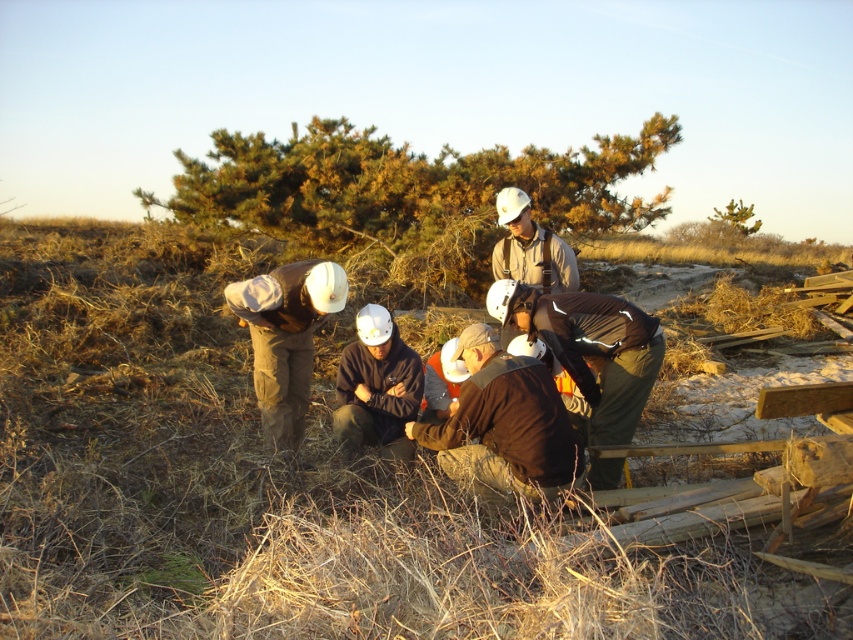
Question: Observing the image, what is the correct spatial positioning of brown fabric jacket at center in reference to dark brown leather jacket at lower center?

Choices:
 (A) below
 (B) above

Answer: (A)

Question: In this image, where is brown fabric jacket at center located relative to dark brown leather jacket at lower center?

Choices:
 (A) above
 (B) below

Answer: (B)

Question: Considering the real-world distances, which object is closest to the matte white hard hat at center?

Choices:
 (A) dark brown jacket at center
 (B) brown fabric jacket at center
 (C) dark brown leather jacket at lower center

Answer: (A)

Question: Which point is farther from the camera taking this photo?

Choices:
 (A) (612, 397)
 (B) (376, 432)
 (C) (483, 449)

Answer: (B)

Question: Which of the following is the farthest from the observer?

Choices:
 (A) matte white hard hat at center
 (B) dark brown jacket at center
 (C) brown fabric jacket at center

Answer: (A)

Question: Does matte white hard hat at center appear on the left side of dark brown jacket at center?

Choices:
 (A) no
 (B) yes

Answer: (B)